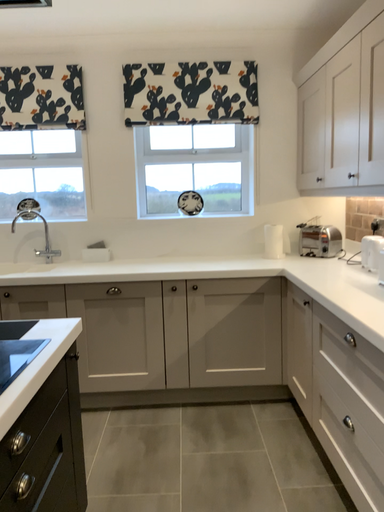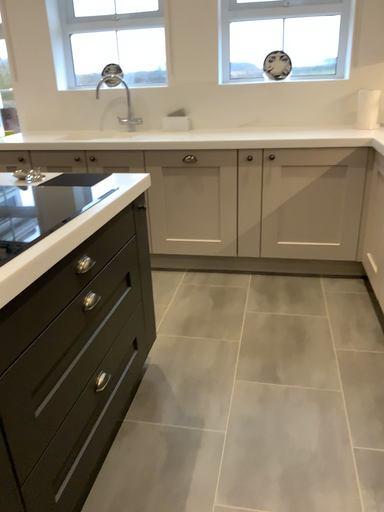
Question: Which way did the camera rotate in the video?

Choices:
 (A) rotated upward
 (B) rotated downward

Answer: (B)